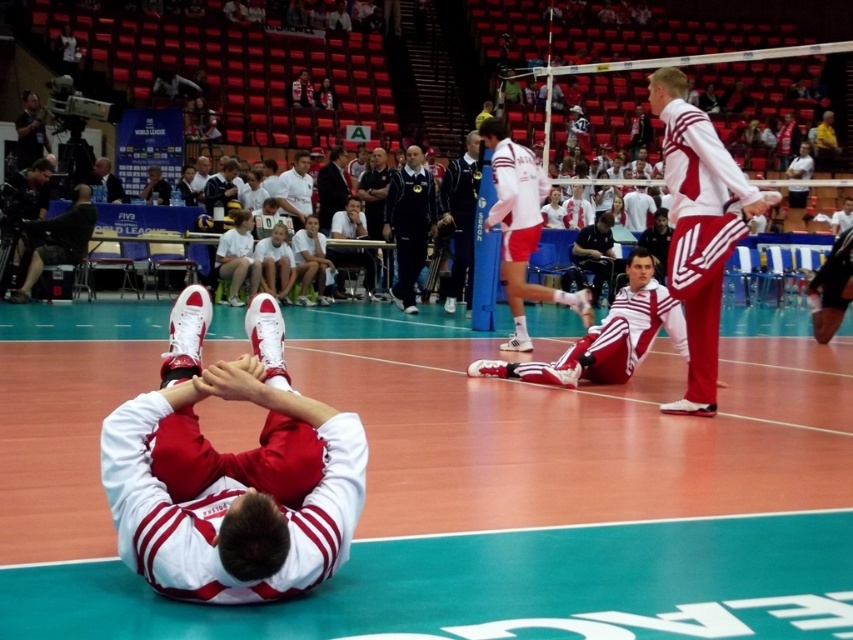
You are a photographer standing at the edge of the volleyball court. You want to take a photo that includes both the matte white sneakers at center and the red seats in the background. Given that your camera has a focal length of 50mm, which is best suited for capturing subjects at medium distances, would you need to adjust your position to ensure both objects are in focus? Explain your reasoning.

The matte white sneakers at center and the red seats in the background are 13.65 feet apart. With a 50mm lens, which is considered a medium focal length, depth of field tends to be deeper compared to longer focal lengths. This means that both the sneakers at center and the distant seats can likely be in focus without needing to adjust your position significantly. However, to ensure both are sharp, you might slightly increase the aperture value for greater depth of field or position yourself equidistant from

You are a photographer positioned at the back of the indoor arena. You need to capture a photo of both the white matte shorts at center and the dark blue smooth tracksuit at center. Based on their positions, which object will appear closer to the bottom of the photo?

The white matte shorts at center will appear closer to the bottom of the photo because it is located below the dark blue smooth tracksuit at center.

Based on the photo, you are a photographer at the volleyball match and need to capture a photo of both the white matte shorts at center and the dark blue smooth tracksuit at center. Which object should you focus on first if you want to include both in the frame without moving the camera?

You should focus on the white matte shorts at center first because it is taller than the dark blue smooth tracksuit at center, ensuring it fits within the frame when positioned properly.